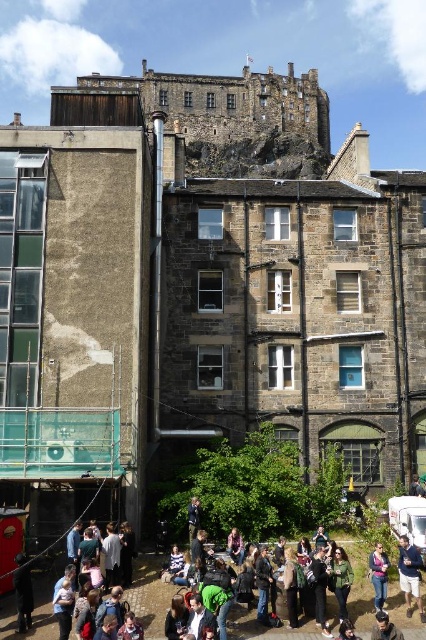
Question: Does green fabric shirt at lower center have a greater width compared to green fabric jacket at lower center?

Choices:
 (A) yes
 (B) no

Answer: (A)

Question: Can you confirm if black leather jacket at lower left is positioned to the left of green fabric jacket at lower center?

Choices:
 (A) yes
 (B) no

Answer: (A)

Question: Can you confirm if green fabric shirt at lower center is smaller than dark brown hair at lower center?

Choices:
 (A) yes
 (B) no

Answer: (B)

Question: Which is farther from the dark brown hair at lower center?

Choices:
 (A) denim jacket at lower right
 (B) green fabric shirt at lower center
 (C) jeans at lower center
 (D) black leather jacket at lower left

Answer: (D)

Question: Among these points, which one is farthest from the camera?

Choices:
 (A) (20, 568)
 (B) (367, 627)

Answer: (A)

Question: Which of these objects is positioned closest to the black leather jacket at lower left?

Choices:
 (A) green fabric jacket at lower center
 (B) denim jacket at lower right
 (C) green fabric shirt at lower center

Answer: (A)